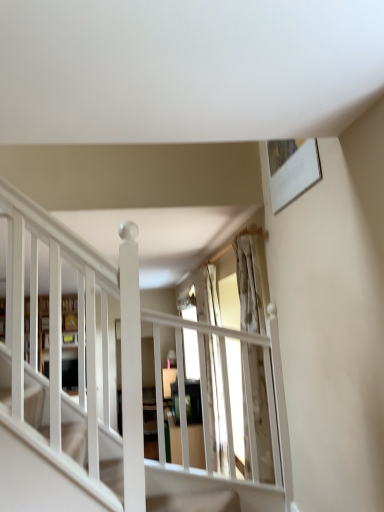
Question: Is white wooden shelf at left placed right next to wooden bookshelf at left?

Choices:
 (A) no
 (B) yes

Answer: (B)

Question: Is white wooden shelf at left aimed at wooden bookshelf at left?

Choices:
 (A) no
 (B) yes

Answer: (B)

Question: Is white wooden shelf at left oriented away from wooden bookshelf at left?

Choices:
 (A) no
 (B) yes

Answer: (B)

Question: Would you say white wooden shelf at left contains wooden bookshelf at left?

Choices:
 (A) no
 (B) yes

Answer: (A)

Question: Is the depth of white wooden shelf at left less than that of wooden bookshelf at left?

Choices:
 (A) no
 (B) yes

Answer: (A)

Question: Does white wooden shelf at left have a lesser width compared to wooden bookshelf at left?

Choices:
 (A) yes
 (B) no

Answer: (A)

Question: Is translucent glass window at center a part of wooden bookshelf at left?

Choices:
 (A) no
 (B) yes

Answer: (A)

Question: Is wooden bookshelf at left outside translucent glass window at center?

Choices:
 (A) yes
 (B) no

Answer: (A)

Question: Does wooden bookshelf at left have a greater height compared to translucent glass window at center?

Choices:
 (A) yes
 (B) no

Answer: (B)

Question: Does wooden bookshelf at left have a lesser height compared to translucent glass window at center?

Choices:
 (A) yes
 (B) no

Answer: (A)

Question: Does wooden bookshelf at left have a lesser width compared to translucent glass window at center?

Choices:
 (A) no
 (B) yes

Answer: (A)

Question: Is wooden bookshelf at left wider than translucent glass window at center?

Choices:
 (A) no
 (B) yes

Answer: (B)

Question: From a real-world perspective, is white wooden shelf at left on translucent glass window at center?

Choices:
 (A) yes
 (B) no

Answer: (A)